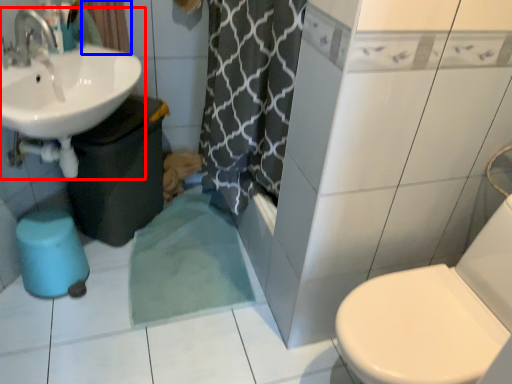
Question: Which of the following is the farthest to the observer, sink (highlighted by a red box) or curtain (highlighted by a blue box)?

Choices:
 (A) sink
 (B) curtain

Answer: (B)